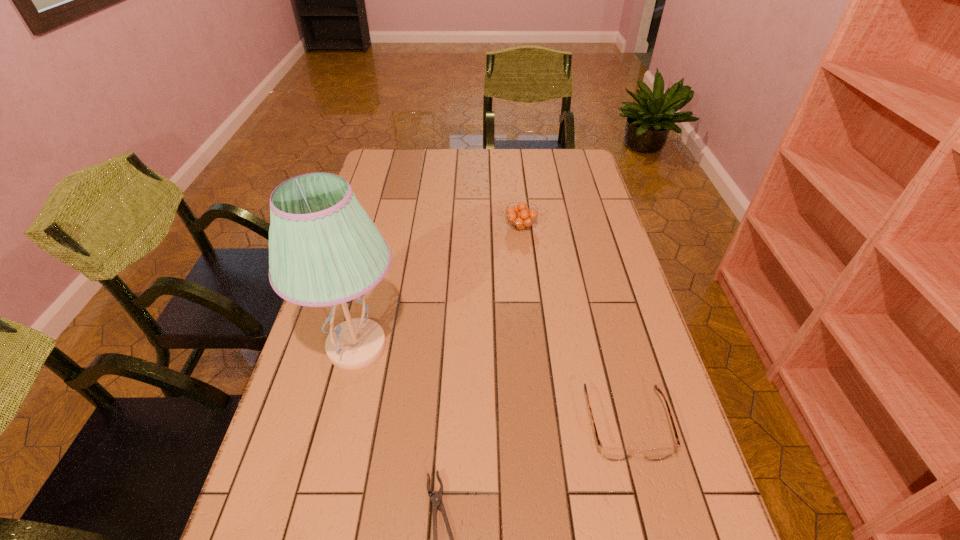
Locate an element on the screen. object that is at the right edge is located at coordinates (612, 454).

The height and width of the screenshot is (540, 960). In order to click on vacant region at the far edge in this screenshot , I will do `click(514, 154)`.

Identify the location of blank space at the left edge of the desktop. (312, 510).

I want to click on vacant region at the right edge of the desktop, so tap(676, 472).

Image resolution: width=960 pixels, height=540 pixels. I want to click on free space between the third farthest object and the second object from right to left, so click(x=573, y=326).

Identify the location of free space between the leftmost object and the spectacles. This screenshot has width=960, height=540. (492, 386).

This screenshot has height=540, width=960. What are the coordinates of `free space between the lamp and the third farthest object` in the screenshot? It's located at (492, 386).

Find the location of `empty space between the spectacles and the third nearest object`. empty space between the spectacles and the third nearest object is located at coordinates (492, 386).

You are a GUI agent. You are given a task and a screenshot of the screen. Output one action in this format:
    pyautogui.click(x=<x>, y=<y>)
    Task: Click on the second closest object relative to the second object from left to right
    
    Given the screenshot: What is the action you would take?
    pyautogui.click(x=612, y=454)

Locate an element on the screen. object that is the third nearest to the shortest object is located at coordinates (520, 216).